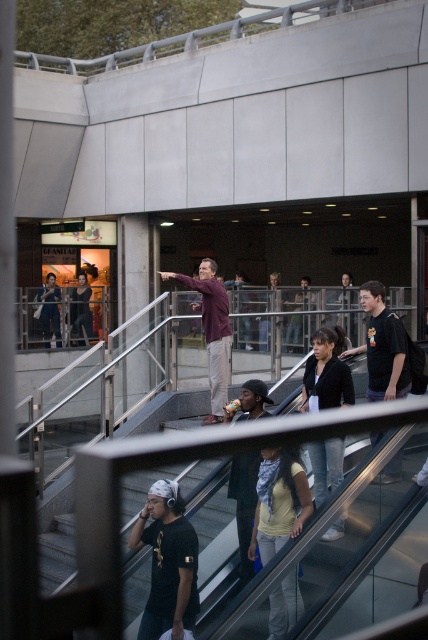
Question: Which of the following is the farthest from the observer?

Choices:
 (A) yellow matte shirt at lower center
 (B) black matte t-shirt at lower left
 (C) black matte shirt at right
 (D) maroon fabric skateboard at center

Answer: (D)

Question: Which object appears closest to the camera in this image?

Choices:
 (A) dark gray hoodie at center
 (B) denim jacket at lower right

Answer: (A)

Question: Can you confirm if yellow matte shirt at lower center is bigger than dark gray hoodie at center?

Choices:
 (A) no
 (B) yes

Answer: (A)

Question: Which of the following is the closest to the observer?

Choices:
 (A) (143, 512)
 (B) (329, 356)
 (C) (293, 513)

Answer: (A)

Question: Does denim jacket at lower right lie behind maroon fabric skateboard at center?

Choices:
 (A) no
 (B) yes

Answer: (A)

Question: Can you confirm if yellow matte shirt at lower center is positioned to the right of denim jacket at lower right?

Choices:
 (A) yes
 (B) no

Answer: (B)